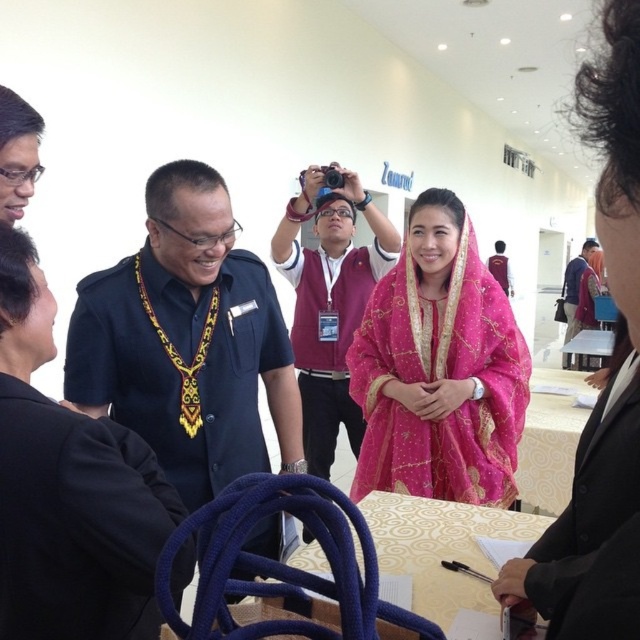
Can you confirm if pink embroidered dress at center is smaller than pink embroidered robe at center?

Yes, pink embroidered dress at center is smaller than pink embroidered robe at center.

Describe the element at coordinates (440, 369) in the screenshot. This screenshot has width=640, height=640. I see `pink embroidered dress at center` at that location.

Is point (460, 499) positioned in front of point (324, 369)?

Yes, point (460, 499) is closer to viewer.

You are a GUI agent. You are given a task and a screenshot of the screen. Output one action in this format:
    pyautogui.click(x=<x>, y=<y>)
    Task: Click on the pink embroidered dress at center
    
    Given the screenshot: What is the action you would take?
    pyautogui.click(x=440, y=369)

Which is in front, point (384, 260) or point (570, 328)?

Point (384, 260) is more forward.

In the scene shown: Who is lower down, pink embroidered robe at center or maroon fabric shirt at center?

pink embroidered robe at center is lower down.

Locate an element on the screen. pink embroidered robe at center is located at coordinates (328, 339).

This screenshot has height=640, width=640. Find the location of `pink embroidered robe at center`. pink embroidered robe at center is located at coordinates (328, 339).

How much distance is there between dark blue uniform at center and black fabric at center?

dark blue uniform at center and black fabric at center are 3.28 feet apart from each other.

Is dark blue uniform at center positioned at the back of black fabric at center?

Yes, it is.

Is point (179, 298) in front of point (624, 592)?

No, (179, 298) is further to viewer.

Locate an element on the screen. dark blue uniform at center is located at coordinates (188, 340).